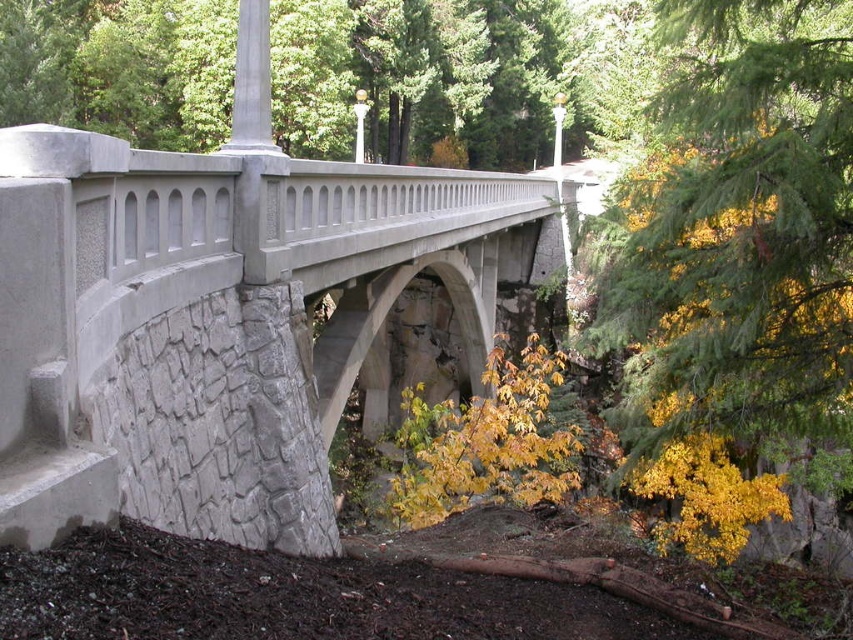
You are standing at the entrance of the forest and see the smooth concrete bridge at center. If you want to reach the bridge, which direction should you walk towards?

The smooth concrete bridge at center is located at point (213, 323), so you should walk towards the center of the image to reach it.